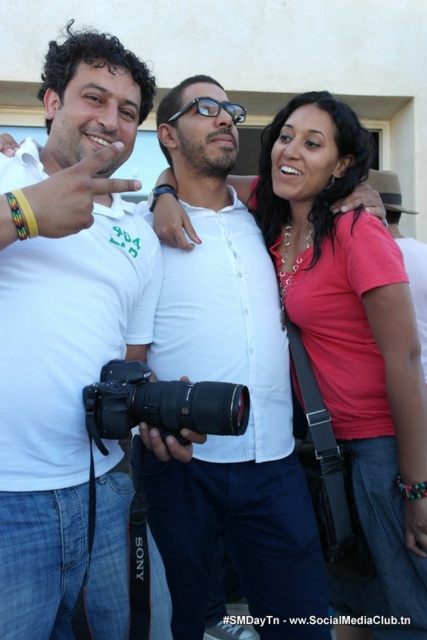
Is white matte shirt at center above black plastic camera at center?

Correct, white matte shirt at center is located above black plastic camera at center.

Does white matte shirt at center have a lesser width compared to black plastic camera at center?

Incorrect, white matte shirt at center's width is not less than black plastic camera at center's.

Is point (70, 312) behind point (114, 417)?

Yes, point (70, 312) is behind point (114, 417).

What are the coordinates of `white matte shirt at center` in the screenshot? It's located at (66, 316).

Is point (377, 276) positioned behind point (143, 388)?

Yes, point (377, 276) is behind point (143, 388).

Does matte pink shirt at center have a larger size compared to black plastic camera at center?

Correct, matte pink shirt at center is larger in size than black plastic camera at center.

Find the location of `matte pink shirt at center`. matte pink shirt at center is located at coordinates (353, 340).

Which is behind, point (5, 589) or point (344, 148)?

The point (344, 148) is more distant.

Which is more to the right, white matte shirt at center or matte pink shirt at center?

matte pink shirt at center is more to the right.

This screenshot has width=427, height=640. What do you see at coordinates (66, 316) in the screenshot?
I see `white matte shirt at center` at bounding box center [66, 316].

I want to click on white matte shirt at center, so click(x=66, y=316).